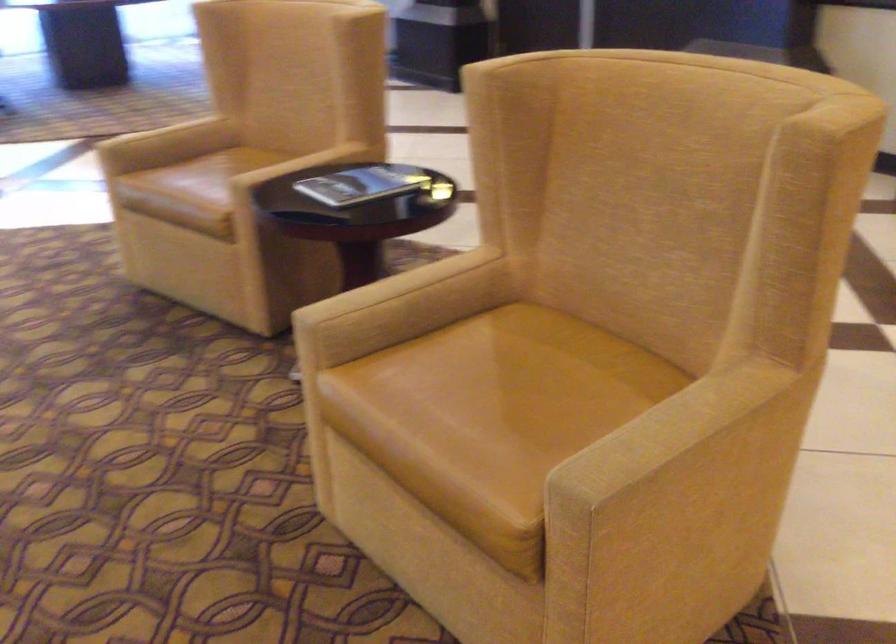
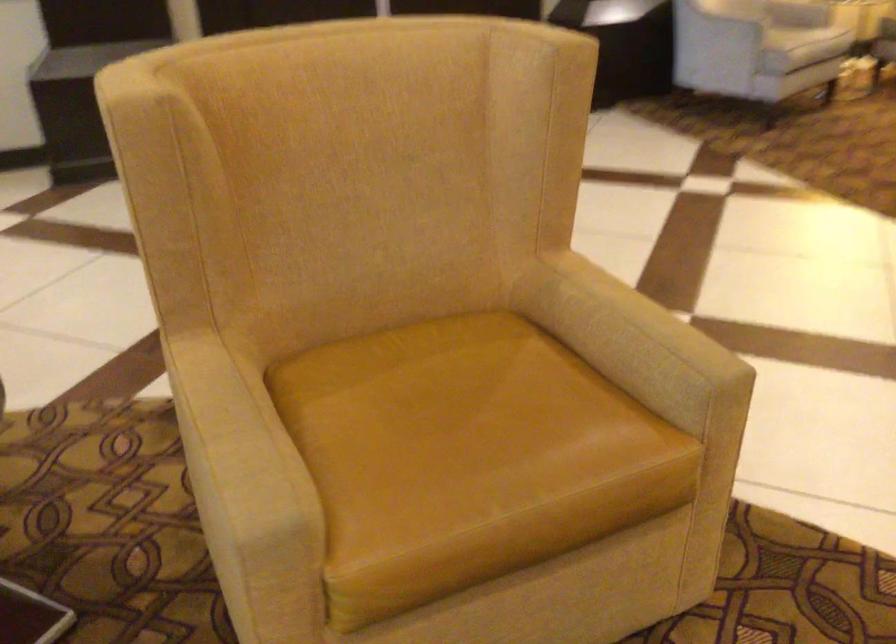
Where in the second image is the point corresponding to point (392, 289) from the first image?

(235, 435)